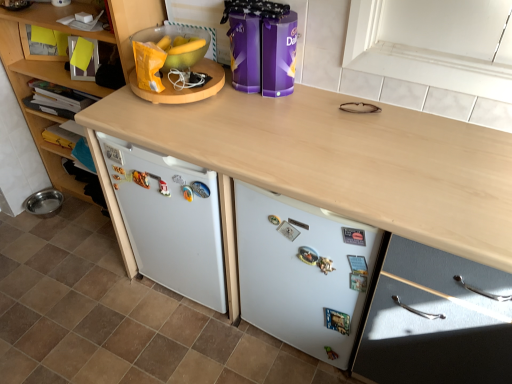
Question: From the image's perspective, is white matte refrigerator at lower center located beneath purple glossy chocolate tins at center, positioned as the 1th appliance in right-to-left order?

Choices:
 (A) no
 (B) yes

Answer: (B)

Question: Is white matte refrigerator at lower center not inside purple glossy chocolate tins at center, positioned as the 1th appliance in right-to-left order?

Choices:
 (A) no
 (B) yes

Answer: (B)

Question: Can you confirm if white matte refrigerator at lower center is thinner than purple glossy chocolate tins at center, arranged as the 2th appliance when viewed from the left?

Choices:
 (A) yes
 (B) no

Answer: (A)

Question: Is the depth of white matte refrigerator at lower center less than that of purple glossy chocolate tins at center, arranged as the 2th appliance when viewed from the left?

Choices:
 (A) no
 (B) yes

Answer: (B)

Question: Could you tell me if white matte refrigerator at lower center is turned towards purple glossy chocolate tins at center, positioned as the 1th appliance in right-to-left order?

Choices:
 (A) yes
 (B) no

Answer: (B)

Question: Is yellow paper bag at upper left, placed as the 1th appliance when sorted from left to right, in front of or behind white glossy tile at lower center in the image?

Choices:
 (A) front
 (B) behind

Answer: (B)

Question: From a real-world perspective, is yellow paper bag at upper left, which appears as the 2th appliance when viewed from the right, positioned above or below white glossy tile at lower center?

Choices:
 (A) below
 (B) above

Answer: (B)

Question: From the image's perspective, relative to white glossy tile at lower center, is yellow paper bag at upper left, placed as the 1th appliance when sorted from left to right, above or below?

Choices:
 (A) below
 (B) above

Answer: (B)

Question: Looking at the image, does yellow paper bag at upper left, which appears as the 2th appliance when viewed from the right, seem bigger or smaller compared to white glossy tile at lower center?

Choices:
 (A) small
 (B) big

Answer: (A)

Question: In the image, is purple glossy chocolate tins at center, arranged as the 2th appliance when viewed from the left, on the left side or the right side of light wood/texture drawer at lower right, arranged as the second cabinetry when viewed from the left?

Choices:
 (A) right
 (B) left

Answer: (B)

Question: From a real-world perspective, relative to light wood/texture drawer at lower right, arranged as the second cabinetry when viewed from the left, is purple glossy chocolate tins at center, arranged as the 2th appliance when viewed from the left, vertically above or below?

Choices:
 (A) above
 (B) below

Answer: (A)

Question: Is purple glossy chocolate tins at center, positioned as the 1th appliance in right-to-left order, inside the boundaries of light wood/texture drawer at lower right, arranged as the second cabinetry when viewed from the left, or outside?

Choices:
 (A) inside
 (B) outside

Answer: (B)

Question: Is purple glossy chocolate tins at center, positioned as the 1th appliance in right-to-left order, bigger or smaller than light wood/texture drawer at lower right, which is the 1th cabinetry from right to left?

Choices:
 (A) small
 (B) big

Answer: (A)

Question: Based on their sizes in the image, would you say wooden cabinet at left, the second cabinetry viewed from the right, is bigger or smaller than yellow paper bag at upper left, placed as the 1th appliance when sorted from left to right?

Choices:
 (A) big
 (B) small

Answer: (A)

Question: Considering the positions of wooden cabinet at left, the second cabinetry viewed from the right, and yellow paper bag at upper left, which appears as the 2th appliance when viewed from the right, in the image, is wooden cabinet at left, the second cabinetry viewed from the right, taller or shorter than yellow paper bag at upper left, which appears as the 2th appliance when viewed from the right,?

Choices:
 (A) tall
 (B) short

Answer: (A)